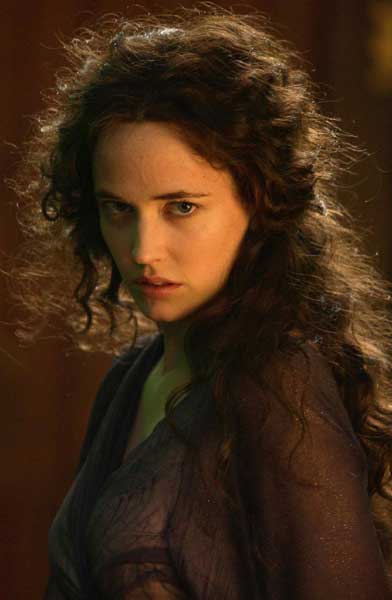
Identify the location of wall. This screenshot has height=600, width=392. (29, 460).